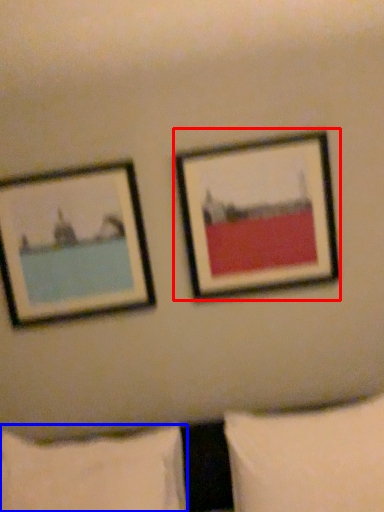
Question: Which object appears closest to the camera in this image, picture frame (highlighted by a red box) or pillow (highlighted by a blue box)?

Choices:
 (A) picture frame
 (B) pillow

Answer: (B)